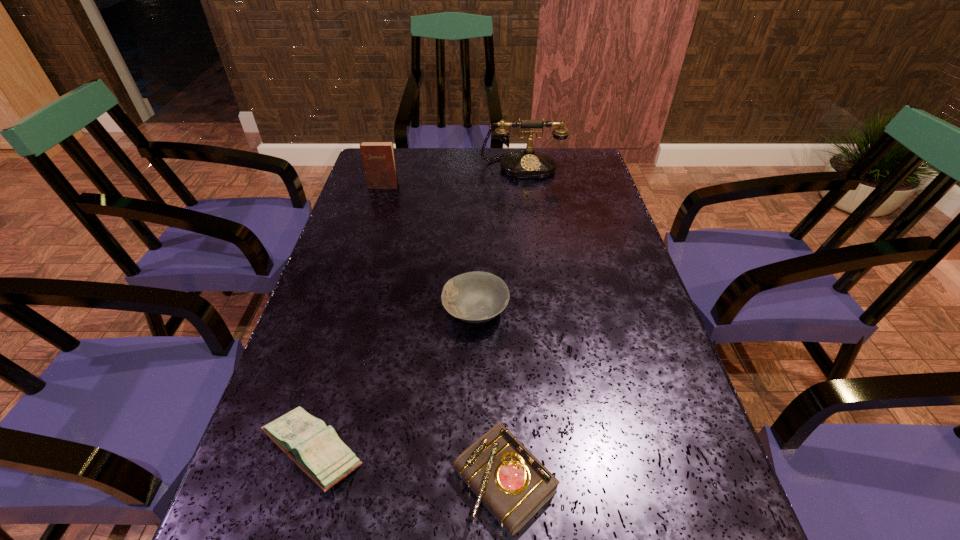
Locate an element on the screen. This screenshot has width=960, height=540. object situated at the far right corner is located at coordinates (529, 164).

You are a GUI agent. You are given a task and a screenshot of the screen. Output one action in this format:
    pyautogui.click(x=<x>, y=<y>)
    Task: Click on the vacant space at the far edge of the desktop
    The width and height of the screenshot is (960, 540).
    Given the screenshot: What is the action you would take?
    pyautogui.click(x=517, y=180)

This screenshot has height=540, width=960. In the image, there is a desktop. Identify the location of vacant space at the left edge. (386, 265).

The width and height of the screenshot is (960, 540). What are the coordinates of `vacant space at the right edge of the desktop` in the screenshot? It's located at (615, 386).

Where is `vacant space at the far right corner of the desktop`? The height and width of the screenshot is (540, 960). vacant space at the far right corner of the desktop is located at coordinates point(571,159).

This screenshot has width=960, height=540. I want to click on blank region between the bowl and the fourth shortest object, so click(429, 248).

Locate an element on the screen. Image resolution: width=960 pixels, height=540 pixels. empty space between the third nearest object and the tallest diary is located at coordinates (429, 248).

Find the location of a particular element. Image resolution: width=960 pixels, height=540 pixels. vacant area that lies between the second farthest object and the telephone is located at coordinates (452, 176).

Image resolution: width=960 pixels, height=540 pixels. What are the coordinates of `free space that is in between the bowl and the tallest object` in the screenshot? It's located at (499, 238).

Where is `empty location between the telephone and the bowl`? empty location between the telephone and the bowl is located at coordinates (499, 238).